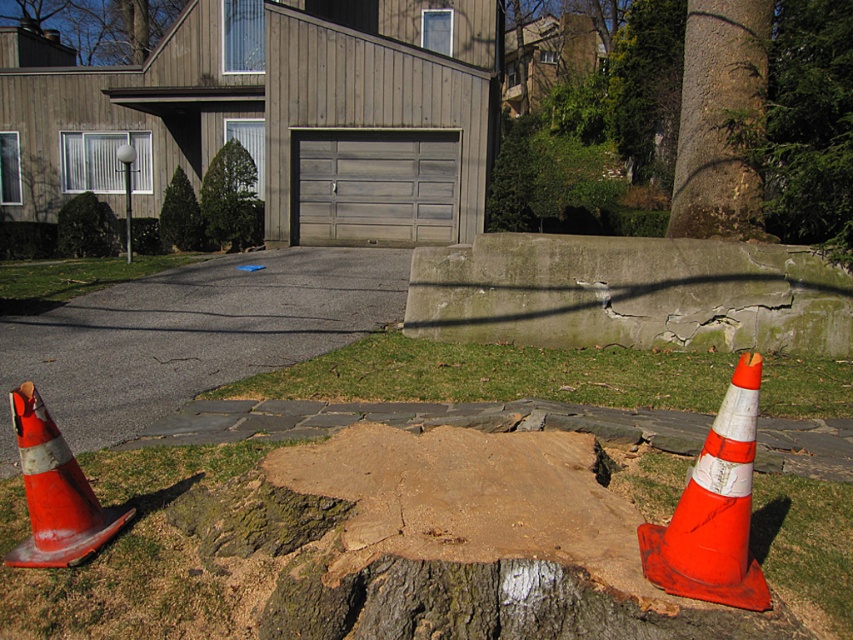
Question: Is the position of orange matte traffic cone at lower right less distant than that of orange reflective cone at left?

Choices:
 (A) yes
 (B) no

Answer: (A)

Question: Does smooth brown tree trunk at upper right appear on the left side of orange matte traffic cone at lower right?

Choices:
 (A) no
 (B) yes

Answer: (A)

Question: Which object is farther from the camera taking this photo?

Choices:
 (A) orange matte traffic cone at lower right
 (B) smooth brown tree trunk at center
 (C) green textured evergreen tree at upper left

Answer: (C)

Question: Is asphalt at lower left further to the viewer compared to orange reflective cone at left?

Choices:
 (A) yes
 (B) no

Answer: (A)

Question: Which point is closer to the camera taking this photo?

Choices:
 (A) (223, 180)
 (B) (62, 429)

Answer: (B)

Question: Among these points, which one is nearest to the camera?

Choices:
 (A) (18, 438)
 (B) (578, 116)

Answer: (A)